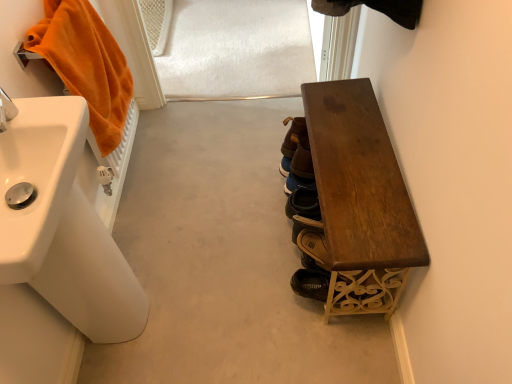
Question: Are orange plush towel at left and white glossy sink at left, the 1th sink when ordered from front to back, making contact?

Choices:
 (A) yes
 (B) no

Answer: (B)

Question: Does orange plush towel at left turn towards white glossy sink at left, which ranks as the 2th sink in back-to-front order?

Choices:
 (A) no
 (B) yes

Answer: (A)

Question: Can you confirm if orange plush towel at left is taller than white glossy sink at left, the 1th sink when ordered from front to back?

Choices:
 (A) no
 (B) yes

Answer: (B)

Question: From a real-world perspective, is orange plush towel at left under white glossy sink at left, which ranks as the 2th sink in back-to-front order?

Choices:
 (A) no
 (B) yes

Answer: (B)

Question: Can you confirm if orange plush towel at left is thinner than white glossy sink at left, which ranks as the 2th sink in back-to-front order?

Choices:
 (A) no
 (B) yes

Answer: (B)

Question: Considering the relative sizes of orange plush towel at left and white glossy sink at left, which ranks as the 2th sink in back-to-front order, in the image provided, is orange plush towel at left smaller than white glossy sink at left, which ranks as the 2th sink in back-to-front order,?

Choices:
 (A) yes
 (B) no

Answer: (B)

Question: Is brown leather shoes at center, which is the second footwear in top-to-bottom order, not inside orange plush towel at left?

Choices:
 (A) yes
 (B) no

Answer: (A)

Question: Considering the relative positions of brown leather shoes at center, positioned as the 3th footwear in front-to-back order, and orange plush towel at left in the image provided, is brown leather shoes at center, positioned as the 3th footwear in front-to-back order, behind orange plush towel at left?

Choices:
 (A) no
 (B) yes

Answer: (B)

Question: Is brown leather shoes at center, positioned as the 3th footwear in front-to-back order, taller than orange plush towel at left?

Choices:
 (A) no
 (B) yes

Answer: (A)

Question: Considering the relative sizes of brown leather shoes at center, which is the second footwear in top-to-bottom order, and orange plush towel at left in the image provided, is brown leather shoes at center, which is the second footwear in top-to-bottom order, smaller than orange plush towel at left?

Choices:
 (A) yes
 (B) no

Answer: (A)

Question: Considering the relative sizes of brown leather shoes at center, which is the second footwear in top-to-bottom order, and orange plush towel at left in the image provided, is brown leather shoes at center, which is the second footwear in top-to-bottom order, wider than orange plush towel at left?

Choices:
 (A) no
 (B) yes

Answer: (A)

Question: Can you confirm if brown leather shoes at center, positioned as the 3th footwear in front-to-back order, is positioned to the left of orange plush towel at left?

Choices:
 (A) no
 (B) yes

Answer: (A)

Question: From the image's perspective, is brown leather shoe at center, which is the second footwear in front-to-back order, on top of orange plush towel at left?

Choices:
 (A) no
 (B) yes

Answer: (A)